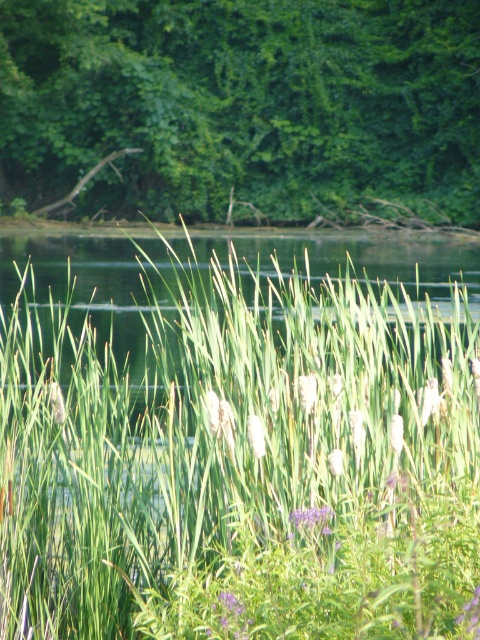
How far apart are green grass at center and green leafy tree at upper center?

They are 10.49 meters apart.

Can you confirm if green grass at center is thinner than green leafy tree at upper center?

Correct, green grass at center's width is less than green leafy tree at upper center's.

Which is behind, point (425, 392) or point (279, 122)?

The point (279, 122) is more distant.

Where is `green grass at center`? This screenshot has width=480, height=640. green grass at center is located at coordinates click(242, 461).